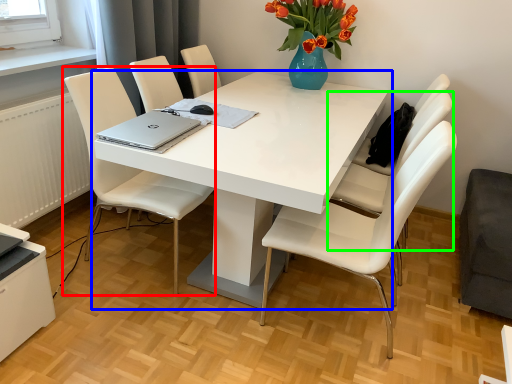
Question: Estimate the real-world distances between objects in this image. Which object is farther from chair (highlighted by a red box), table (highlighted by a blue box) or chair (highlighted by a green box)?

Choices:
 (A) table
 (B) chair

Answer: (B)